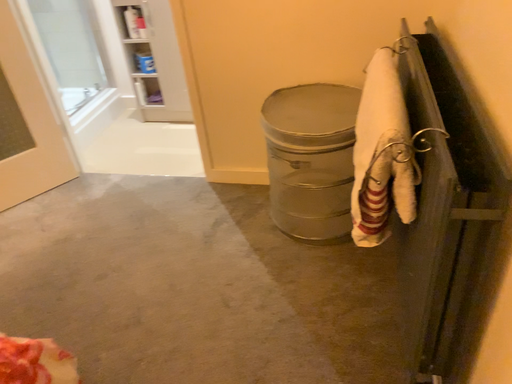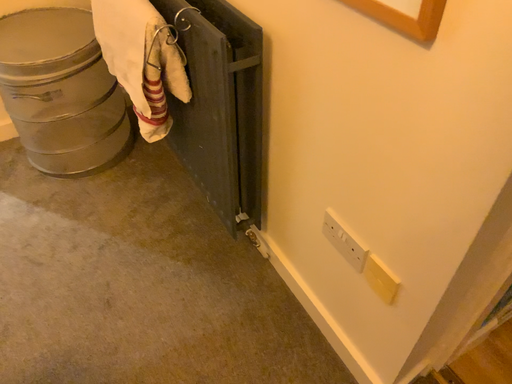
Question: How did the camera likely rotate when shooting the video?

Choices:
 (A) rotated right
 (B) rotated left

Answer: (A)